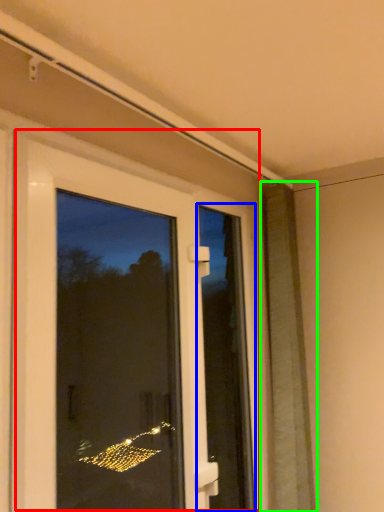
Question: Which object is positioned closest to door (highlighted by a red box)? Select from screen door (highlighted by a blue box) and shutter (highlighted by a green box).

Choices:
 (A) screen door
 (B) shutter

Answer: (A)